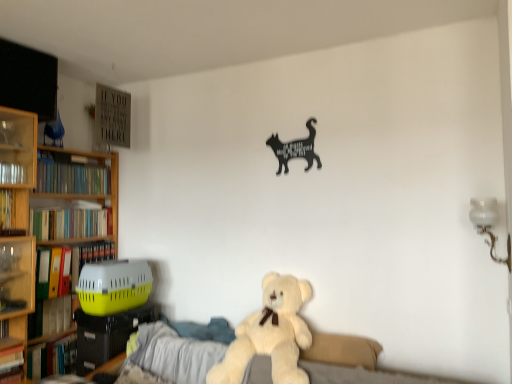
Question: Looking at their shapes, would you say hardcover book at left, the 7th book when ordered from top to bottom, is wider or thinner than green matte bookshelf at left, which ranks as the first book in top-to-bottom order?

Choices:
 (A) wide
 (B) thin

Answer: (B)

Question: Considering their positions, is hardcover book at left, the 7th book when ordered from top to bottom, located in front of or behind green matte bookshelf at left, which is counted as the seventh book, starting from the bottom?

Choices:
 (A) front
 (B) behind

Answer: (A)

Question: Based on their relative distances, which object is farther from the hardcover books at left, the fifth book positioned from the bottom?

Choices:
 (A) fluffy white teddy bear at center
 (B) yellow matte folder at left, positioned as the 4th book in top-to-bottom order
 (C) black matte cat at upper center
 (D) hardcover book at left, the 2th book positioned from the bottom
 (E) yellow plastic pet carrier at left, the third book in the bottom-to-top sequence

Answer: (C)

Question: Which object is the farthest from the black matte cat at upper center?

Choices:
 (A) green matte bookshelf at left, which is counted as the seventh book, starting from the bottom
 (B) hardcover book at left, arranged as the 2th book when viewed from the top
 (C) yellow plastic pet carrier at left, which is the 5th book from top to bottom
 (D) fluffy white teddy bear at center
 (E) yellow matte folder at left, the 4th book in the bottom-to-top sequence

Answer: (B)